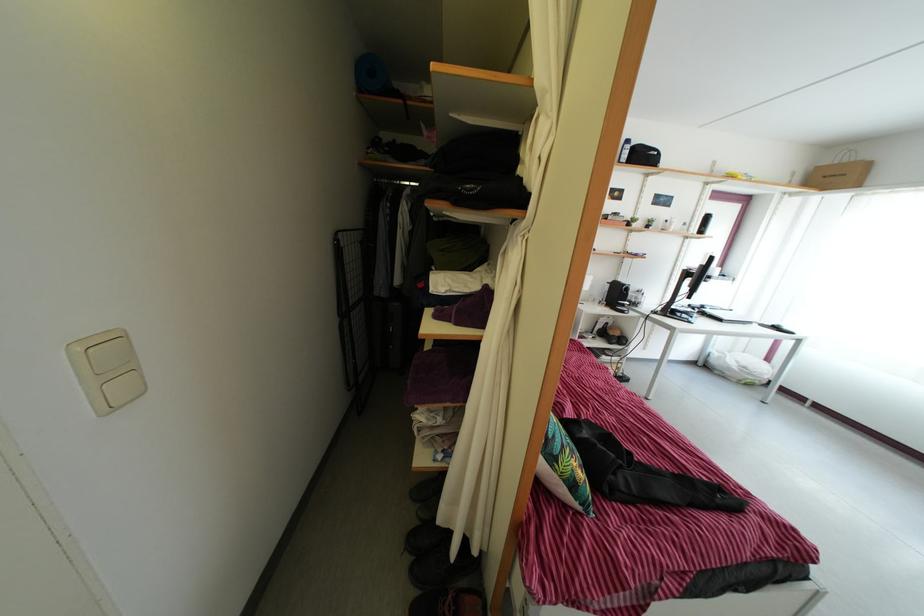
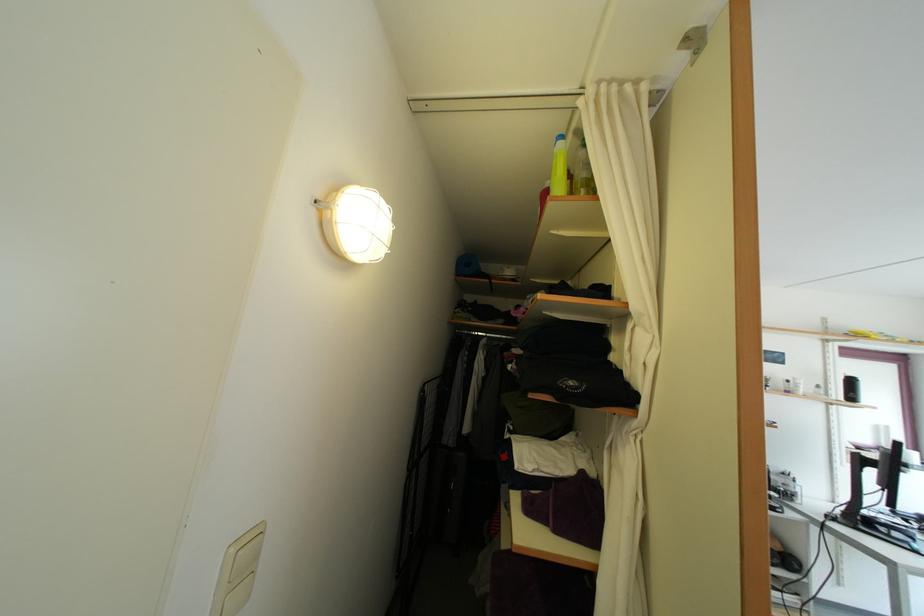
Find the pixel in the second image that matches point 86,358 in the first image.

(239, 559)